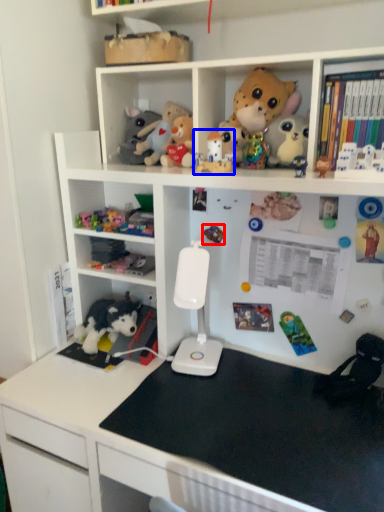
Question: Among these objects, which one is farthest to the camera, toy (highlighted by a red box) or toy (highlighted by a blue box)?

Choices:
 (A) toy
 (B) toy

Answer: (A)